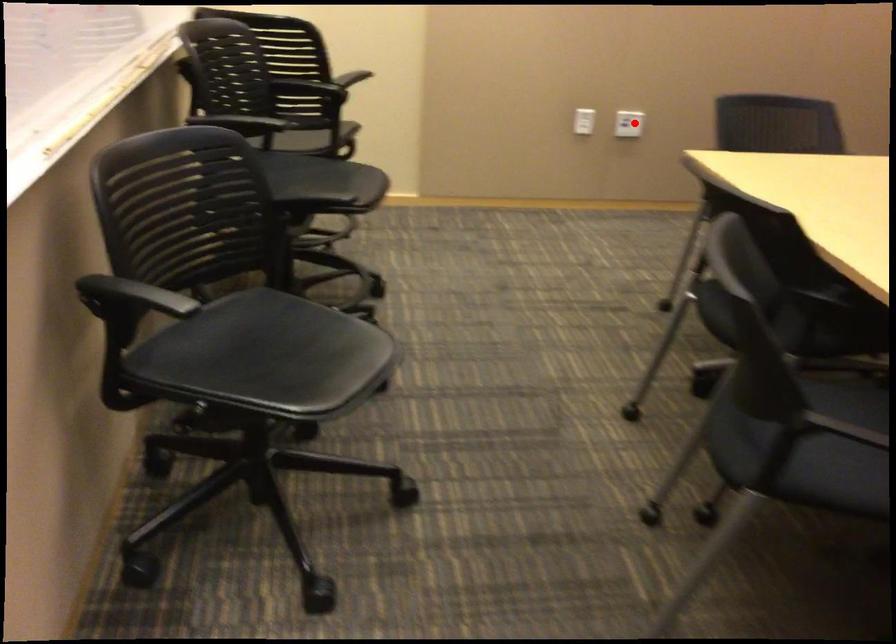
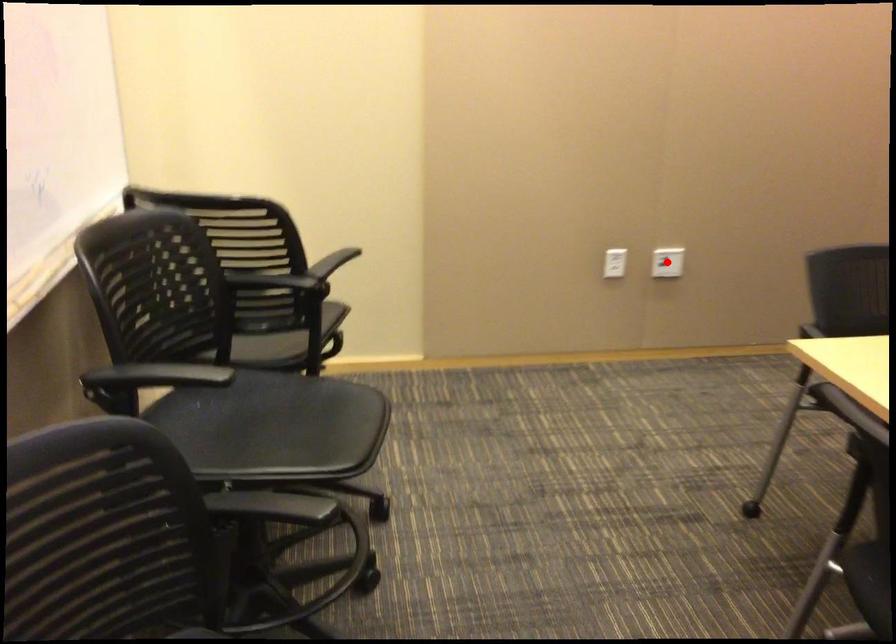
I am providing you with two images of the same scene from different viewpoints. A red point is marked on the first image and another point is marked on the second image. Do the highlighted points in image1 and image2 indicate the same real-world spot?

Yes